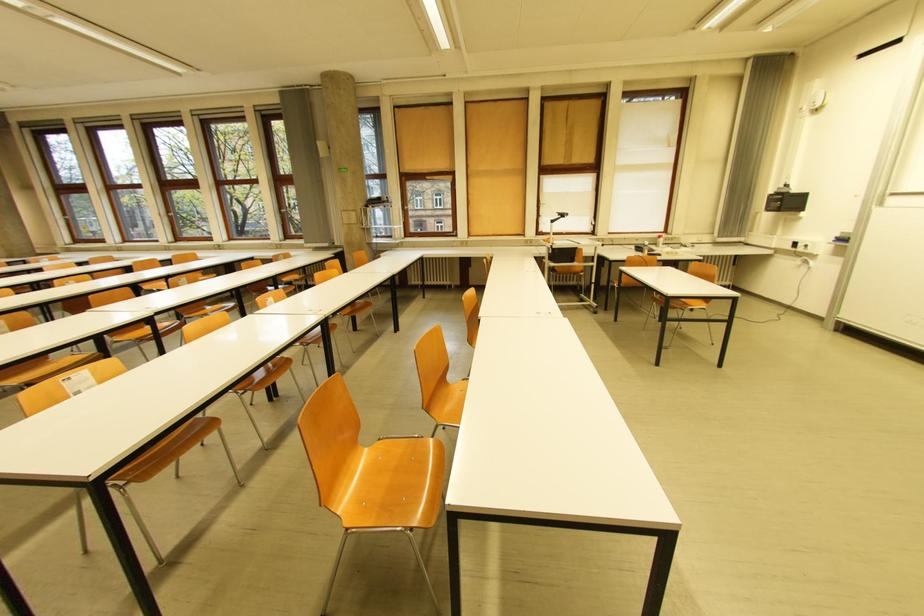
What are the coordinates of `overhead projector head` in the screenshot? It's located at (812, 98).